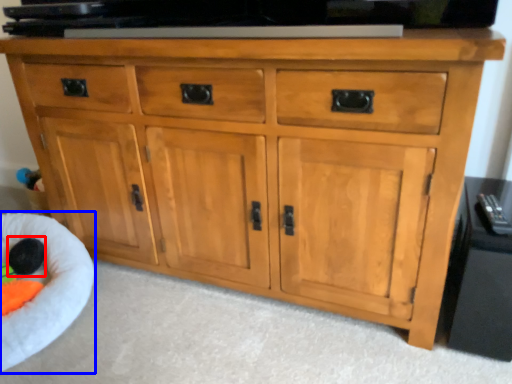
Question: Which of the following is the farthest to the observer, toy (highlighted by a red box) or infant bed (highlighted by a blue box)?

Choices:
 (A) toy
 (B) infant bed

Answer: (A)